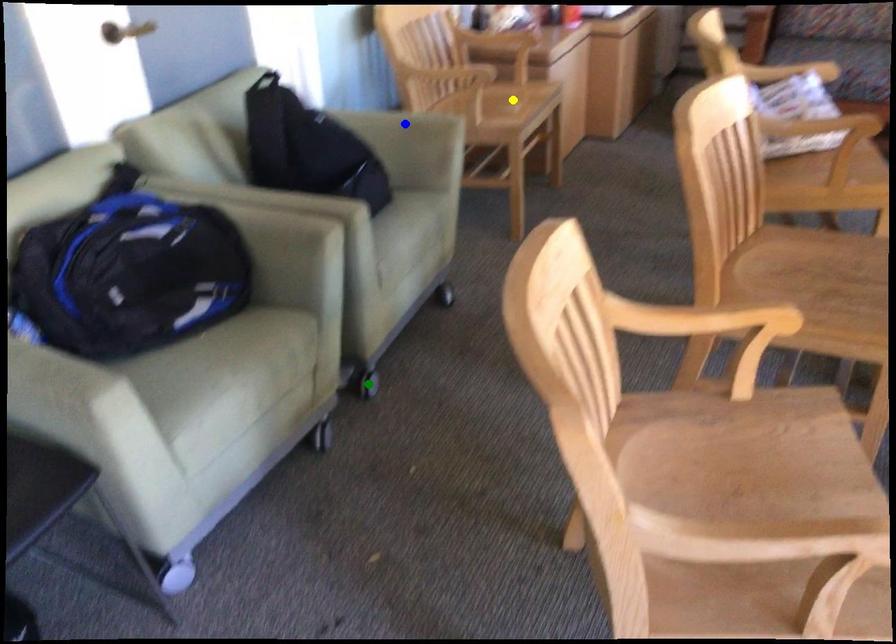
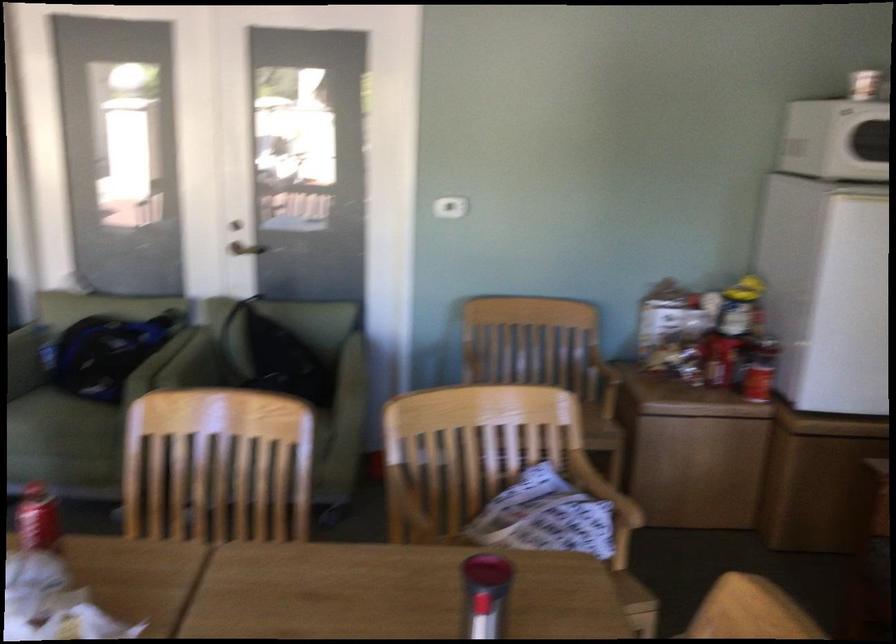
I am providing you with two images of the same scene from different viewpoints. Three points are marked in image1. Which point corresponds to a part or object that is occluded in image2?In image1, three points are marked. Which of them correspond to a part or object that is occluded in image2?Among the three points shown in image1, which one corresponds to a part or object that is no longer visible due to occlusion in image2?

yellow point, blue point, green point